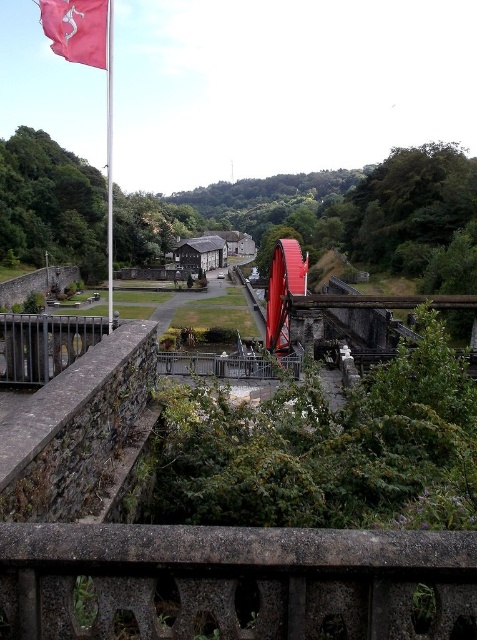
Question: Estimate the real-world distances between objects in this image. Which object is farther from the red metallic flag pole at upper left?

Choices:
 (A) pink fabric flag at upper left
 (B) concrete textured balustrade at lower center

Answer: (A)

Question: Which object is the farthest from the concrete textured balustrade at lower center?

Choices:
 (A) pink fabric flag at upper left
 (B) red metallic flag pole at upper left

Answer: (B)

Question: Is concrete textured balustrade at lower center below red metallic flag pole at upper left?

Choices:
 (A) yes
 (B) no

Answer: (A)

Question: Estimate the real-world distances between objects in this image. Which object is farther from the pink fabric flag at upper left?

Choices:
 (A) concrete textured balustrade at lower center
 (B) red metallic flag pole at upper left

Answer: (B)

Question: Is concrete textured balustrade at lower center above pink fabric flag at upper left?

Choices:
 (A) yes
 (B) no

Answer: (B)

Question: Can you confirm if concrete textured balustrade at lower center is smaller than pink fabric flag at upper left?

Choices:
 (A) no
 (B) yes

Answer: (B)